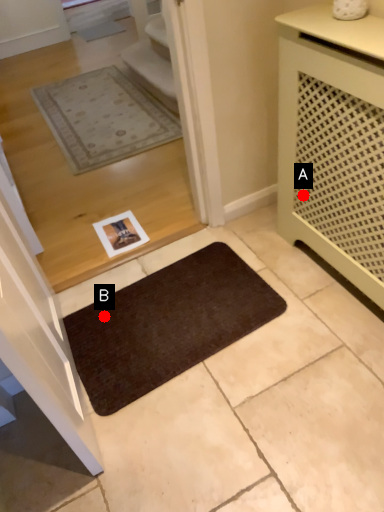
Question: Two points are circled on the image, labeled by A and B beside each circle. Which point is closer to the camera taking this photo?

Choices:
 (A) A is closer
 (B) B is closer

Answer: (A)